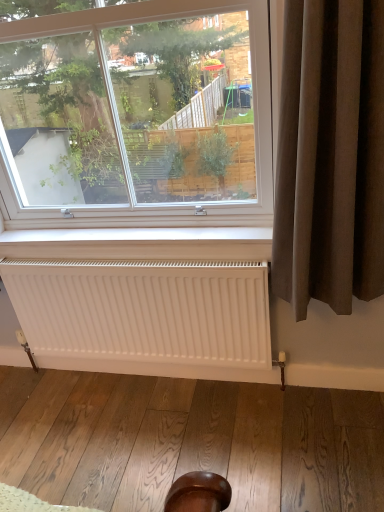
Question: Would you say white matte radiator at lower center is a long distance from clear glass window at upper center?

Choices:
 (A) no
 (B) yes

Answer: (A)

Question: Could you tell me if white matte radiator at lower center is facing clear glass window at upper center?

Choices:
 (A) yes
 (B) no

Answer: (B)

Question: Is white matte radiator at lower center oriented away from clear glass window at upper center?

Choices:
 (A) no
 (B) yes

Answer: (A)

Question: Is white matte radiator at lower center positioned beyond the bounds of clear glass window at upper center?

Choices:
 (A) no
 (B) yes

Answer: (B)

Question: Is white matte radiator at lower center with clear glass window at upper center?

Choices:
 (A) no
 (B) yes

Answer: (A)

Question: Is brown fabric curtain at right taller or shorter than white matte radiator at lower center?

Choices:
 (A) short
 (B) tall

Answer: (B)

Question: Considering the positions of point (375, 154) and point (183, 351), is point (375, 154) closer or farther from the camera than point (183, 351)?

Choices:
 (A) closer
 (B) farther

Answer: (A)

Question: Considering their positions, is brown fabric curtain at right located in front of or behind white matte radiator at lower center?

Choices:
 (A) front
 (B) behind

Answer: (A)

Question: In terms of width, does brown fabric curtain at right look wider or thinner when compared to white matte radiator at lower center?

Choices:
 (A) thin
 (B) wide

Answer: (B)

Question: Choose the correct answer: Is white matte radiator at lower center inside clear glass window at upper center or outside it?

Choices:
 (A) outside
 (B) inside

Answer: (A)

Question: Considering the positions of point (160, 313) and point (251, 40), is point (160, 313) closer or farther from the camera than point (251, 40)?

Choices:
 (A) closer
 (B) farther

Answer: (B)

Question: From their relative heights in the image, would you say white matte radiator at lower center is taller or shorter than clear glass window at upper center?

Choices:
 (A) tall
 (B) short

Answer: (B)

Question: From the image's perspective, is white matte radiator at lower center located above or below clear glass window at upper center?

Choices:
 (A) above
 (B) below

Answer: (B)

Question: Is white matte radiator at lower center in front of or behind brown fabric curtain at right in the image?

Choices:
 (A) behind
 (B) front

Answer: (A)

Question: Considering the relative positions of white matte radiator at lower center and brown fabric curtain at right in the image provided, is white matte radiator at lower center to the left or to the right of brown fabric curtain at right?

Choices:
 (A) left
 (B) right

Answer: (A)